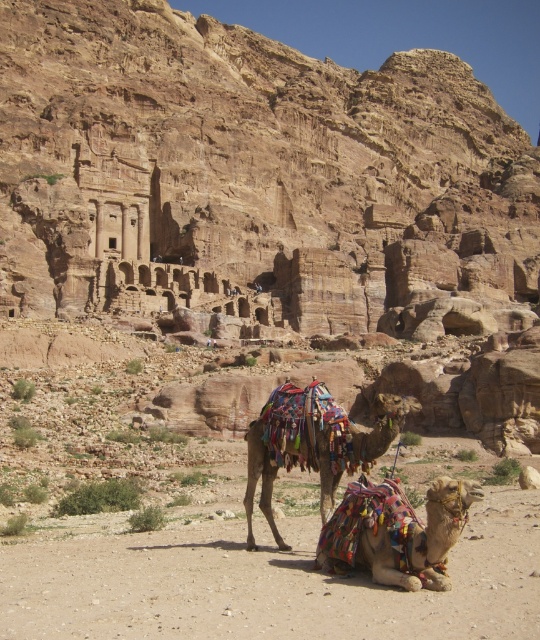
Which is behind, point (363, 561) or point (353, 460)?

Point (353, 460)

Is the position of multicolored fabric camel at lower center less distant than that of multicolored fabric camel at center?

Yes, multicolored fabric camel at lower center is in front of multicolored fabric camel at center.

Is point (459, 500) farther from viewer compared to point (320, 456)?

No, (459, 500) is closer to viewer.

You are a GUI agent. You are given a task and a screenshot of the screen. Output one action in this format:
    pyautogui.click(x=<x>, y=<y>)
    Task: Click on the multicolored fabric camel at lower center
    This screenshot has width=540, height=640.
    Given the screenshot: What is the action you would take?
    pyautogui.click(x=396, y=532)